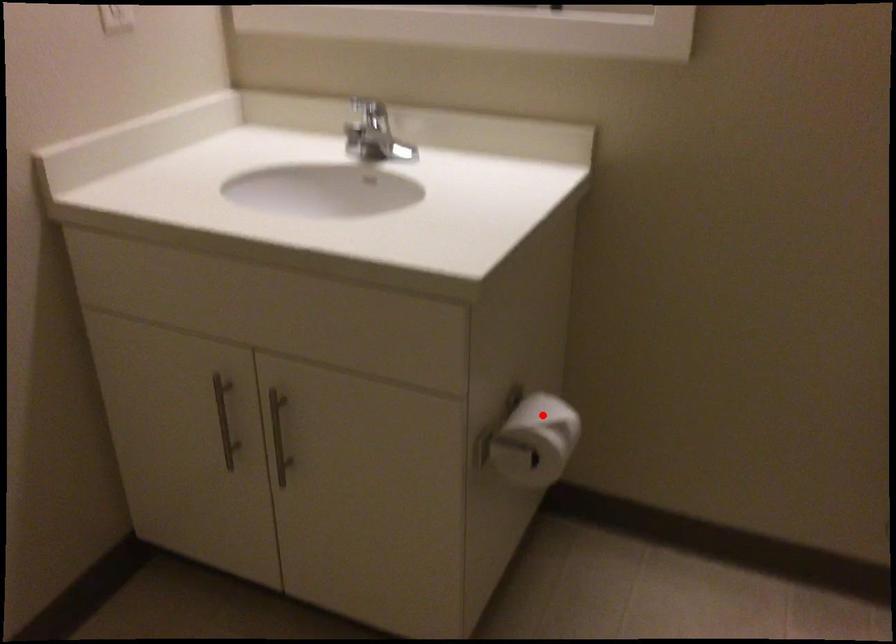
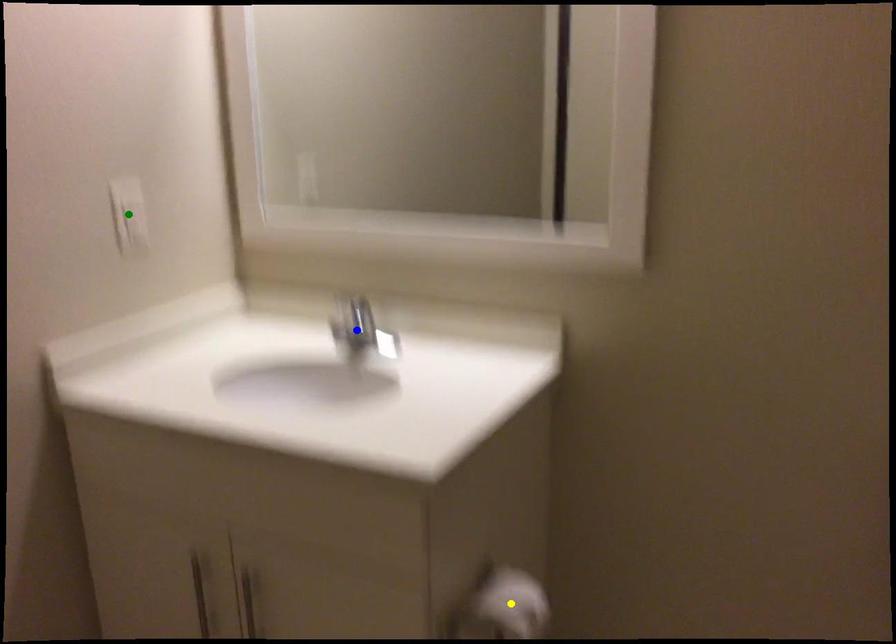
Question: I am providing you with two images of the same scene from different viewpoints. A red point is marked on the first image. You are given multiple points on the second image. Can you choose the point in image 2 that corresponds to the point in image 1?

Choices:
 (A) blue point
 (B) green point
 (C) yellow point

Answer: (C)